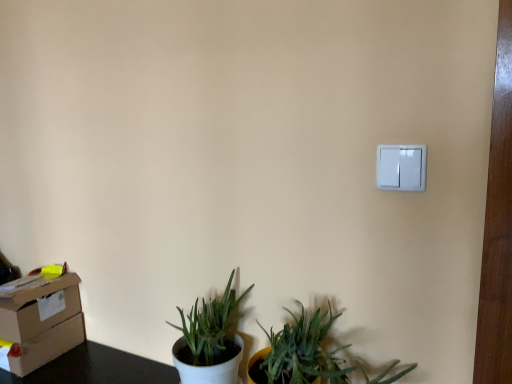
Question: Is matte brown cardboard box at lower left surrounded by white plastic light switch at upper right?

Choices:
 (A) yes
 (B) no

Answer: (B)

Question: Is white plastic light switch at upper right closer to camera compared to matte brown cardboard box at lower left?

Choices:
 (A) no
 (B) yes

Answer: (B)

Question: Considering the relative sizes of white plastic light switch at upper right and matte brown cardboard box at lower left in the image provided, is white plastic light switch at upper right smaller than matte brown cardboard box at lower left?

Choices:
 (A) no
 (B) yes

Answer: (B)

Question: Is white plastic light switch at upper right touching matte brown cardboard box at lower left?

Choices:
 (A) no
 (B) yes

Answer: (A)

Question: Would you say white plastic light switch at upper right is outside matte brown cardboard box at lower left?

Choices:
 (A) yes
 (B) no

Answer: (A)

Question: Do you think matte brown cardboard box at lower left is within white matte pot at lower left, or outside of it?

Choices:
 (A) inside
 (B) outside

Answer: (B)

Question: In terms of size, does matte brown cardboard box at lower left appear bigger or smaller than white matte pot at lower left?

Choices:
 (A) big
 (B) small

Answer: (A)

Question: From the image's perspective, is matte brown cardboard box at lower left positioned above or below white matte pot at lower left?

Choices:
 (A) above
 (B) below

Answer: (B)

Question: Is matte brown cardboard box at lower left to the left or to the right of white matte pot at lower left in the image?

Choices:
 (A) right
 (B) left

Answer: (B)

Question: Is white plastic light switch at upper right inside or outside of matte brown cardboard box at lower left?

Choices:
 (A) inside
 (B) outside

Answer: (B)

Question: In the image, is white plastic light switch at upper right positioned in front of or behind matte brown cardboard box at lower left?

Choices:
 (A) behind
 (B) front

Answer: (B)

Question: In terms of height, does white plastic light switch at upper right look taller or shorter compared to matte brown cardboard box at lower left?

Choices:
 (A) tall
 (B) short

Answer: (B)

Question: Based on their sizes in the image, would you say white plastic light switch at upper right is bigger or smaller than matte brown cardboard box at lower left?

Choices:
 (A) small
 (B) big

Answer: (A)

Question: Looking at the image, does white plastic light switch at upper right seem bigger or smaller compared to white matte pot at lower left?

Choices:
 (A) small
 (B) big

Answer: (A)

Question: Based on their positions, is white plastic light switch at upper right located to the left or right of white matte pot at lower left?

Choices:
 (A) right
 (B) left

Answer: (A)